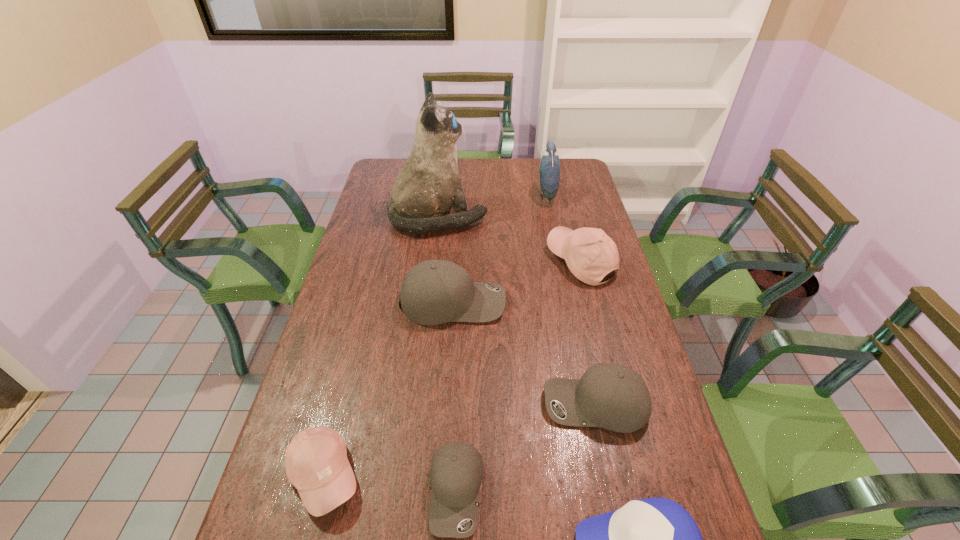
Where is `vacant area situated 0.170m at the face of the tallest object`? The width and height of the screenshot is (960, 540). vacant area situated 0.170m at the face of the tallest object is located at coordinates (531, 218).

The width and height of the screenshot is (960, 540). I want to click on vacant space situated at the tip of the bird's beak, so click(x=477, y=195).

In order to click on free space located 0.160m at the tip of the bird's beak in this screenshot , I will do `click(498, 195)`.

What are the coordinates of `free location located at the tip of the bird's beak` in the screenshot? It's located at (493, 195).

This screenshot has width=960, height=540. Find the location of `blank space located on the front brim of the farthest gray baseball cap`. blank space located on the front brim of the farthest gray baseball cap is located at coordinates (560, 302).

What are the coordinates of `vacant space located 0.380m on the front-facing side of the right pink baseball cap` in the screenshot? It's located at (439, 262).

Identify the location of vacant region located 0.190m on the front-facing side of the right pink baseball cap. (493, 262).

The image size is (960, 540). What are the coordinates of `vacant space positioned 0.230m on the front-facing side of the right pink baseball cap` in the screenshot? It's located at (482, 262).

Locate an element on the screen. vacant space situated 0.150m on the front brim of the second farthest gray baseball cap is located at coordinates (485, 405).

Find the location of a particular element. This screenshot has width=960, height=540. vacant space located on the front brim of the second farthest gray baseball cap is located at coordinates (391, 405).